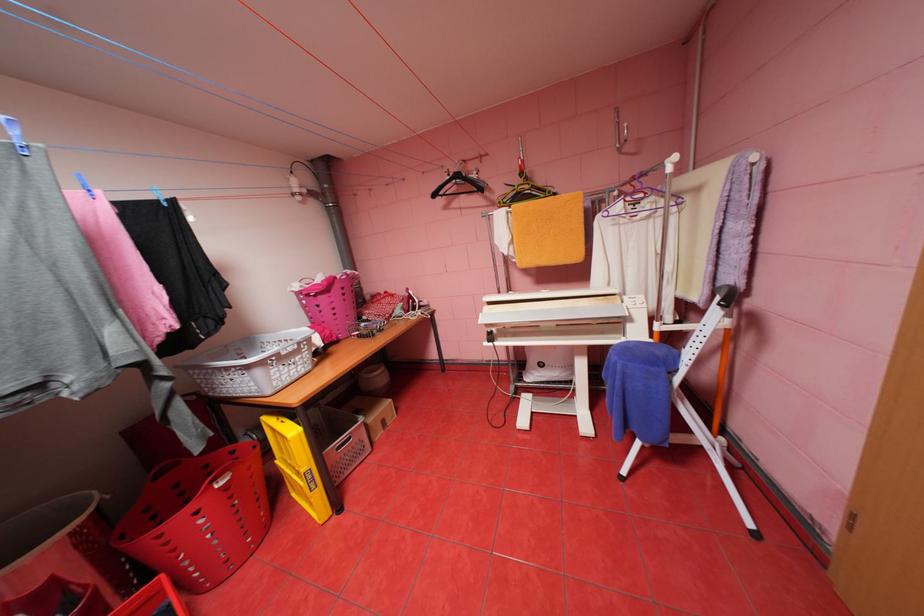
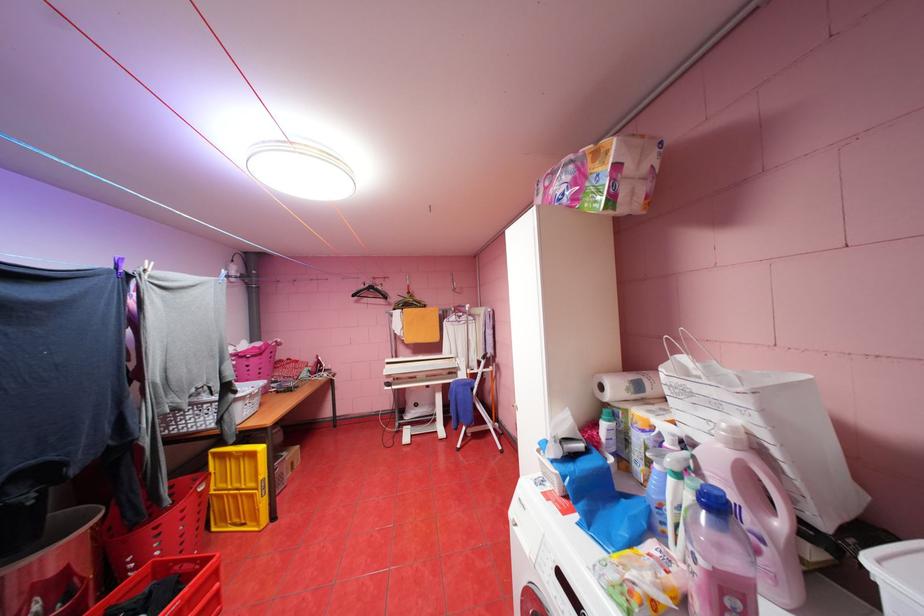
Where in the second image is the point corresponding to (x=443, y=195) from the first image?

(361, 294)